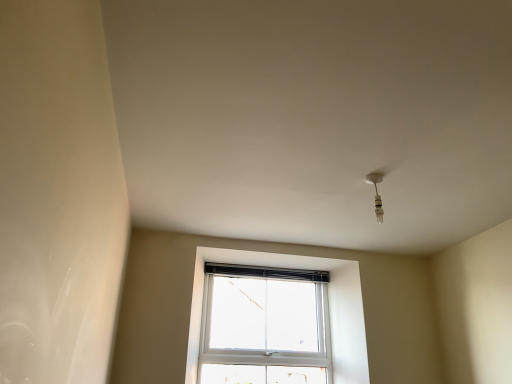
Locate an element on the screen. white plastic light bulb at upper center is located at coordinates (377, 193).

This screenshot has width=512, height=384. What do you see at coordinates (377, 193) in the screenshot?
I see `white plastic light bulb at upper center` at bounding box center [377, 193].

Find the location of a particular element. white plastic light bulb at upper center is located at coordinates (377, 193).